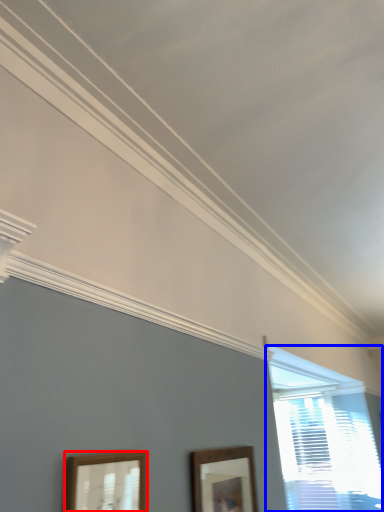
Question: Among these objects, which one is nearest to the camera, picture frame (highlighted by a red box) or window (highlighted by a blue box)?

Choices:
 (A) picture frame
 (B) window

Answer: (A)